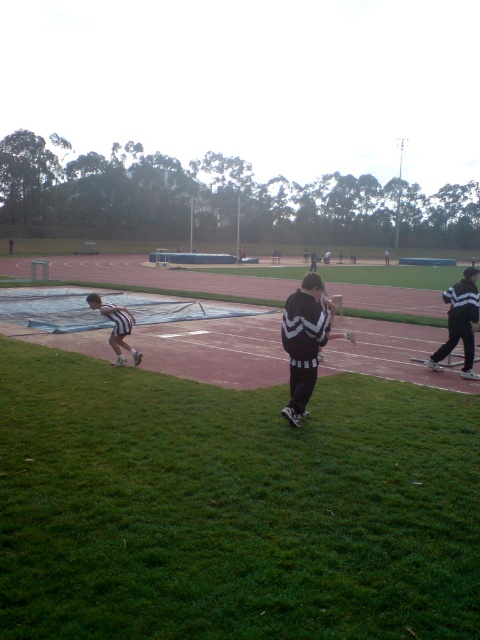
Question: Which point is closer to the camera taking this photo?

Choices:
 (A) (310, 314)
 (B) (437, 358)

Answer: (A)

Question: Is green grass at lower left thinner than white athletic shorts at lower left?

Choices:
 (A) yes
 (B) no

Answer: (B)

Question: From the image, what is the correct spatial relationship of black and white striped jacket at right in relation to white athletic shorts at lower left?

Choices:
 (A) left
 (B) right

Answer: (B)

Question: Which object appears farthest from the camera in this image?

Choices:
 (A) green grass at lower left
 (B) white athletic shorts at lower left
 (C) black and white striped jacket at center

Answer: (B)

Question: Can you confirm if green grass at lower left is bigger than black and white striped jacket at right?

Choices:
 (A) yes
 (B) no

Answer: (A)

Question: Among these points, which one is farthest from the camera?

Choices:
 (A) [x=202, y=490]
 (B) [x=457, y=326]

Answer: (B)